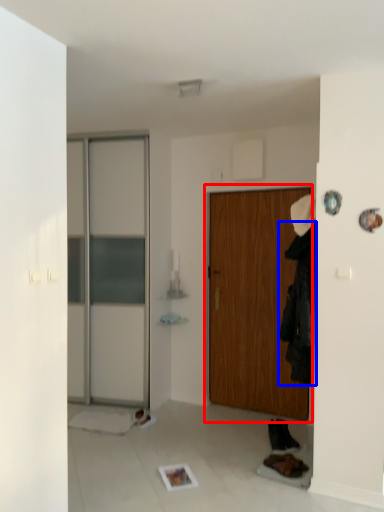
Question: Which of the following is the farthest to the observer, door (highlighted by a red box) or clothing (highlighted by a blue box)?

Choices:
 (A) door
 (B) clothing

Answer: (A)